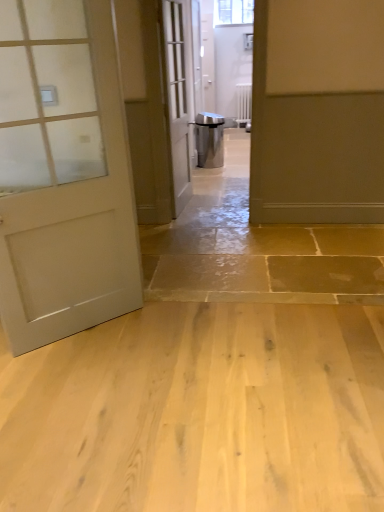
Where is `vacant space to the right of matte white door at left, which is the 1th door from left to right`? This screenshot has width=384, height=512. vacant space to the right of matte white door at left, which is the 1th door from left to right is located at coordinates (163, 338).